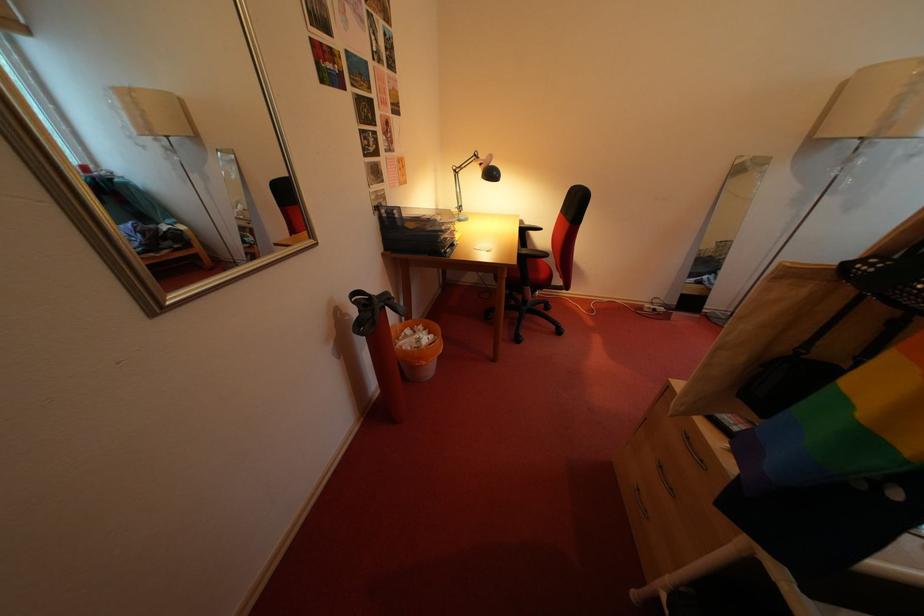
Find the location of `black printer`. black printer is located at coordinates (417, 230).